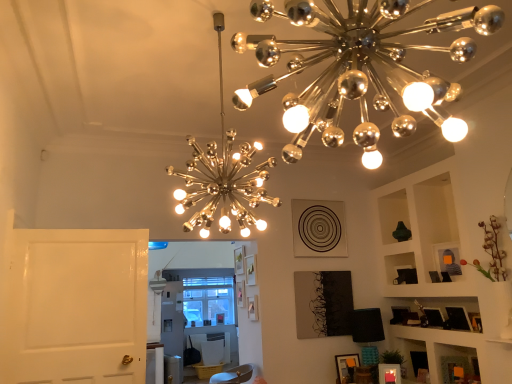
Question: From a real-world perspective, is metallic chandelier at upper center, which ranks as the 2th lamp in right-to-left order, above or below white glossy door at left?

Choices:
 (A) below
 (B) above

Answer: (B)

Question: Considering the relative positions of metallic chandelier at upper center, which ranks as the 3th lamp in bottom-to-top order, and white glossy door at left in the image provided, is metallic chandelier at upper center, which ranks as the 3th lamp in bottom-to-top order, to the left or to the right of white glossy door at left?

Choices:
 (A) right
 (B) left

Answer: (A)

Question: Estimate the real-world distances between objects in this image. Which object is farther from the white glossy door at left?

Choices:
 (A) wooden picture frame at center, the 1th picture frame viewed from the left
 (B) black fabric lampshade at lower right, the 1th lamp in the bottom-to-top sequence
 (C) wooden picture frame at lower right, the second picture frame viewed from the left
 (D) metallic chandelier at upper center, the first lamp when ordered from top to bottom
 (E) metallic silver chandelier at upper center, the second lamp when ordered from back to front

Answer: (B)

Question: Which is nearer to the black fabric lampshade at lower right, acting as the 1th lamp starting from the back?

Choices:
 (A) metallic chandelier at upper center, acting as the third lamp starting from the back
 (B) wooden picture frame at center, positioned as the 2th picture frame in front-to-back order
 (C) metallic silver chandelier at upper center, positioned as the 2th lamp in front-to-back order
 (D) white glossy door at left
 (E) matte black frame at lower right

Answer: (E)